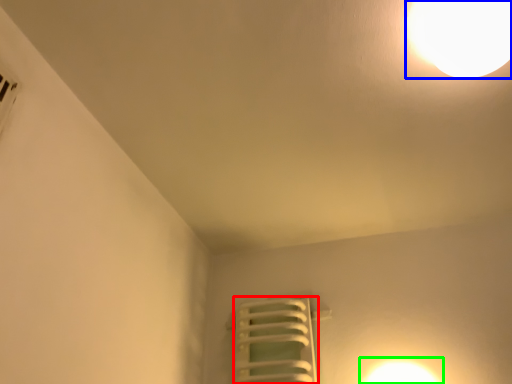
Question: Which is nearer to the radiator (highlighted by a red box)? lamp (highlighted by a blue box) or light (highlighted by a green box).

Choices:
 (A) lamp
 (B) light

Answer: (B)